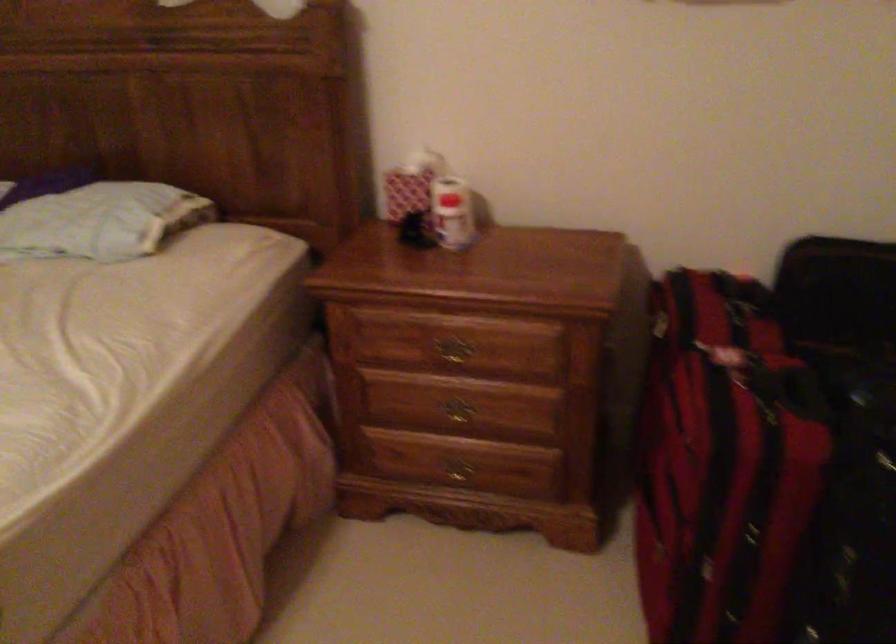
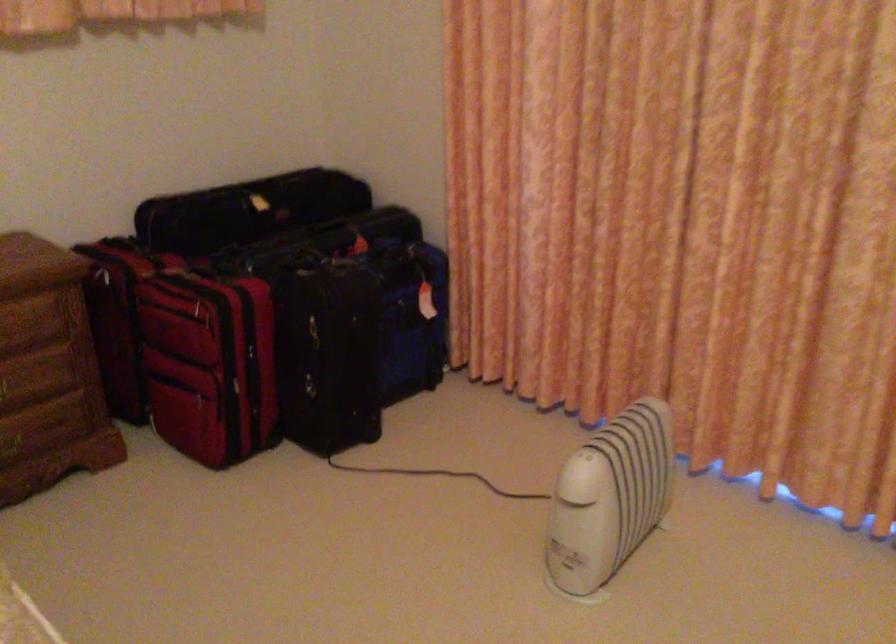
Locate, in the second image, the point that corresponds to (x=761, y=436) in the first image.

(243, 292)